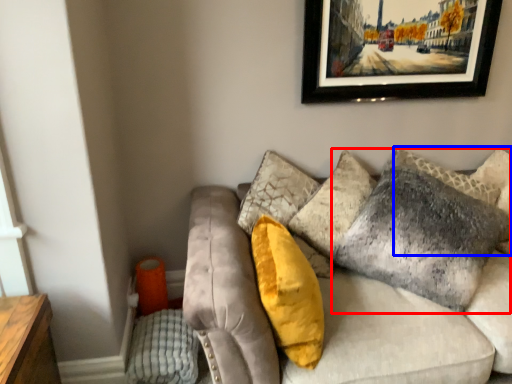
Question: Among these objects, which one is nearest to the camera, pillow (highlighted by a red box) or pillow (highlighted by a blue box)?

Choices:
 (A) pillow
 (B) pillow

Answer: (A)